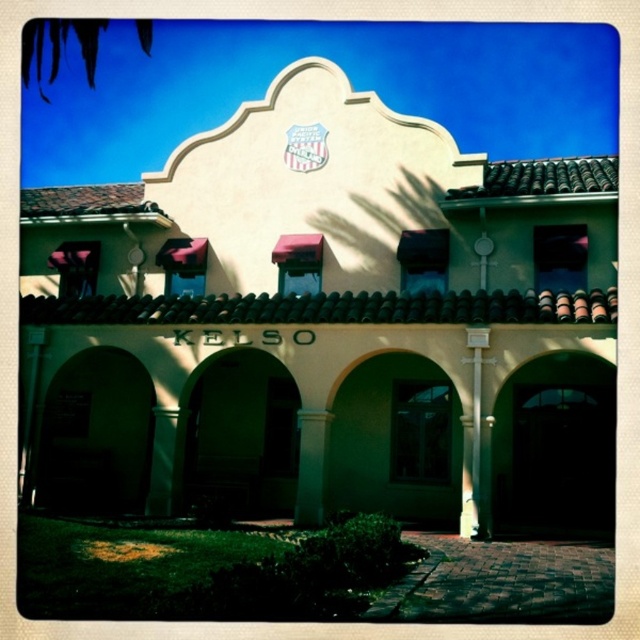
Question: Is green stone column at center below green stone pillar at center?

Choices:
 (A) no
 (B) yes

Answer: (A)

Question: Which point is farther to the camera?

Choices:
 (A) (323, 433)
 (B) (147, 500)

Answer: (B)

Question: In this image, where is green stone column at center located relative to green stone pillar at center?

Choices:
 (A) below
 (B) above

Answer: (B)

Question: Which point is closer to the camera?

Choices:
 (A) (308, 413)
 (B) (161, 488)

Answer: (A)

Question: Which object appears closest to the camera in this image?

Choices:
 (A) green stone pillar at center
 (B) green stone column at center

Answer: (B)

Question: Does green stone column at center appear over green stone pillar at center?

Choices:
 (A) no
 (B) yes

Answer: (B)